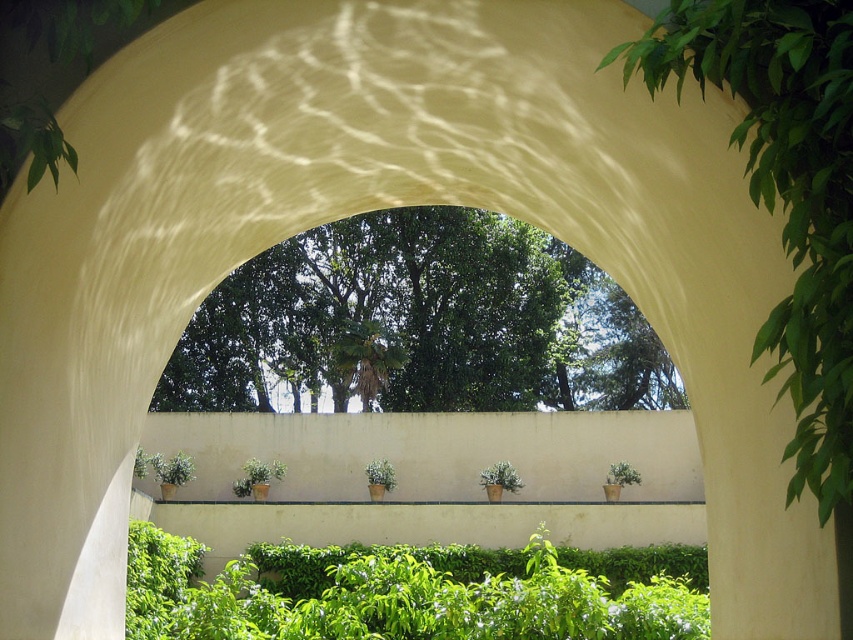
Can you confirm if green leafy hedge at center is shorter than green leafy tree at right?

Incorrect, green leafy hedge at center's height does not fall short of green leafy tree at right's.

Does green leafy hedge at center appear on the right side of green leafy tree at right?

No, green leafy hedge at center is not to the right of green leafy tree at right.

Looking at this image, measure the distance between green leafy hedge at center and camera.

green leafy hedge at center is 25.17 feet from camera.

I want to click on green leafy hedge at center, so click(x=415, y=592).

This screenshot has width=853, height=640. What do you see at coordinates (415, 592) in the screenshot?
I see `green leafy hedge at center` at bounding box center [415, 592].

Can you confirm if green leafy hedge at center is bigger than green matte plant at center?

Yes, green leafy hedge at center is bigger than green matte plant at center.

What do you see at coordinates (415, 592) in the screenshot? The width and height of the screenshot is (853, 640). I see `green leafy hedge at center` at bounding box center [415, 592].

In order to click on green leafy hedge at center in this screenshot , I will do `click(415, 592)`.

Is point (364, 228) positioned before point (570, 634)?

No.

Based on the photo, who is more distant from viewer, (479, 364) or (311, 627)?

Positioned behind is point (479, 364).

Which is behind, point (270, 269) or point (496, 595)?

Point (270, 269)

Where is `green leafy tree at center`? This screenshot has width=853, height=640. green leafy tree at center is located at coordinates (421, 323).